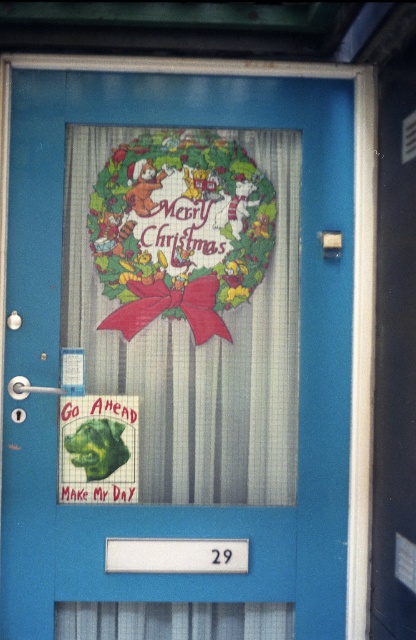
Does point (91, 392) come closer to viewer compared to point (94, 481)?

No.

Who is more distant from viewer, (279,385) or (62,486)?

Positioned behind is point (279,385).

Find the location of `decorative paper wreath at center`. decorative paper wreath at center is located at coordinates (182, 312).